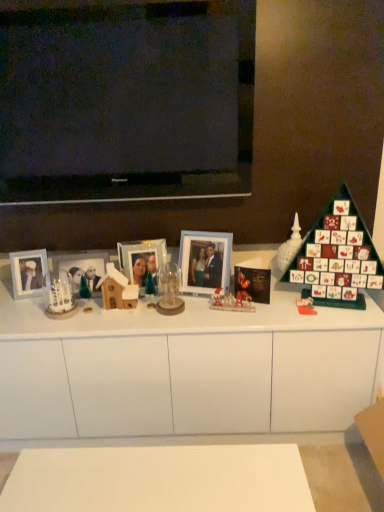
This screenshot has width=384, height=512. Identify the location of vacant space to the left of wooden house at center, arranged as the fifth toy when viewed from the right. (78, 315).